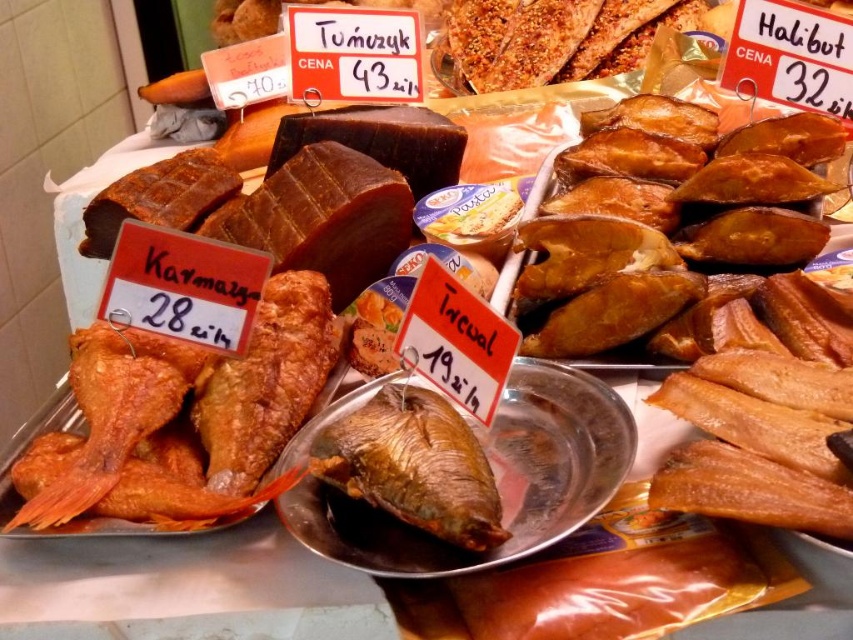
Between golden brown dried fish at center and brown matte fish at center, which one has less height?

With less height is brown matte fish at center.

Between golden brown dried fish at center and brown matte fish at center, which one is positioned higher?

brown matte fish at center

Is point (352, 506) positioned before point (422, 404)?

Yes, it is in front of point (422, 404).

You are a GUI agent. You are given a task and a screenshot of the screen. Output one action in this format:
    pyautogui.click(x=<x>, y=<y>)
    Task: Click on the golden brown dried fish at center
    
    Given the screenshot: What is the action you would take?
    pyautogui.click(x=494, y=477)

Between brown smoked fish at right and golden brown dried fish at center, which one has less height?

Standing shorter between the two is golden brown dried fish at center.

Does point (541, 285) come in front of point (532, 467)?

That is False.

Image resolution: width=853 pixels, height=640 pixels. Describe the element at coordinates (664, 220) in the screenshot. I see `brown smoked fish at right` at that location.

Where is `brown smoked fish at right`? This screenshot has height=640, width=853. brown smoked fish at right is located at coordinates point(664,220).

Can you confirm if brown smoked fish at right is shorter than brown matte fish at center?

In fact, brown smoked fish at right may be taller than brown matte fish at center.

Consider the image. Does brown smoked fish at right appear on the right side of brown matte fish at center?

Correct, you'll find brown smoked fish at right to the right of brown matte fish at center.

The image size is (853, 640). What do you see at coordinates (664, 220) in the screenshot? I see `brown smoked fish at right` at bounding box center [664, 220].

Locate an element on the screen. The height and width of the screenshot is (640, 853). brown smoked fish at right is located at coordinates (664, 220).